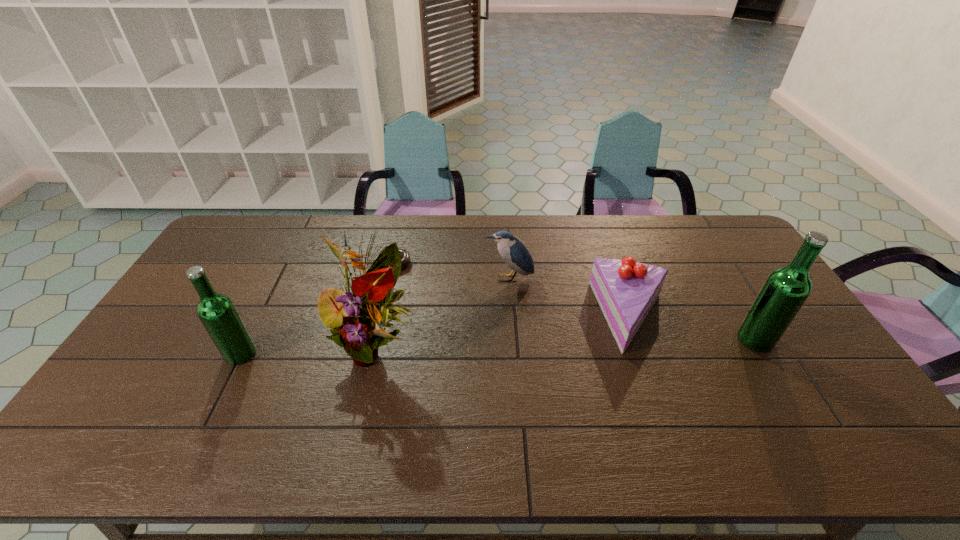
The height and width of the screenshot is (540, 960). I want to click on free space located 0.190m on the right of the left beer bottle, so click(x=324, y=354).

Identify the location of free space located on the back of the rightmost object. This screenshot has width=960, height=540. (731, 298).

This screenshot has height=540, width=960. In order to click on vacant space located on the front of the doughnut in this screenshot , I will do `click(389, 305)`.

I want to click on vacant space located on the front of the cake, so click(662, 402).

Locate an element on the screen. This screenshot has height=540, width=960. vacant space situated at the tip of the third shortest object's beak is located at coordinates (516, 387).

You are a GUI agent. You are given a task and a screenshot of the screen. Output one action in this format:
    pyautogui.click(x=<x>, y=<y>)
    Task: Click on the vacant space situated on the front-facing side of the bouquet
    Image resolution: width=960 pixels, height=540 pixels.
    Given the screenshot: What is the action you would take?
    pyautogui.click(x=362, y=416)

Where is `object positioned at the right edge`? object positioned at the right edge is located at coordinates (786, 289).

Image resolution: width=960 pixels, height=540 pixels. Find the location of `vacant region at the far edge of the desktop`. vacant region at the far edge of the desktop is located at coordinates (372, 230).

In the image, there is a desktop. Identify the location of vacant region at the near edge. Image resolution: width=960 pixels, height=540 pixels. (732, 407).

In the image, there is a desktop. Where is `free space at the far left corner`? The image size is (960, 540). free space at the far left corner is located at coordinates (271, 221).